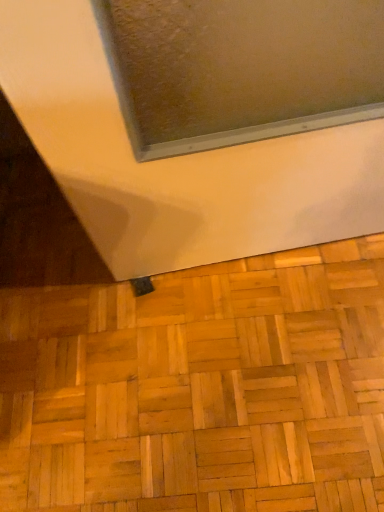
What do you see at coordinates (200, 388) in the screenshot? I see `natural wood parquet floor at lower center` at bounding box center [200, 388].

The height and width of the screenshot is (512, 384). I want to click on natural wood parquet floor at lower center, so click(x=200, y=388).

Find the location of `natural wood parquet floor at lower center`. natural wood parquet floor at lower center is located at coordinates (200, 388).